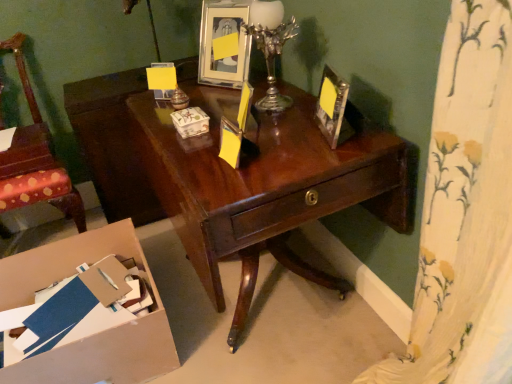
Locate an element on the screen. vacant space that's between silver metallic candle holder at upper right and metallic silver picture frame at upper right, the second picture frame positioned from the back is located at coordinates (300, 121).